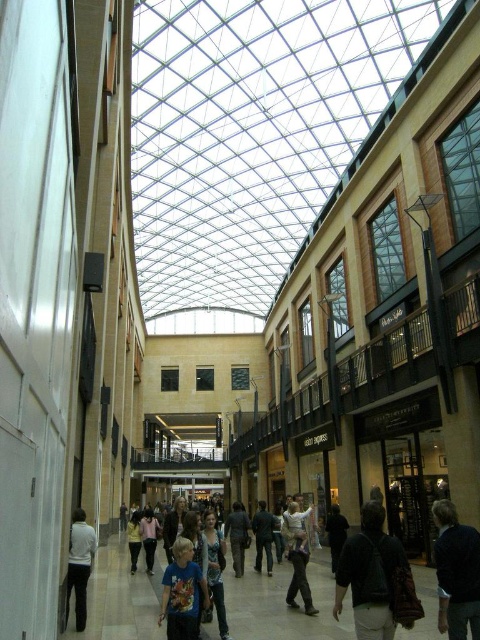
Question: Among these points, which one is nearest to the camera?

Choices:
 (A) (182, 628)
 (B) (435, 540)
 (C) (264, 522)
 (D) (73, 536)

Answer: (A)

Question: Among these objects, which one is farthest from the camera?

Choices:
 (A) dark blue jacket at center
 (B) dark blue jeans at center

Answer: (B)

Question: Is dark gray backpack at lower right below dark blue jeans at center?

Choices:
 (A) no
 (B) yes

Answer: (A)

Question: Is dark gray backpack at lower right closer to the viewer compared to dark blue jeans at center?

Choices:
 (A) yes
 (B) no

Answer: (A)

Question: Is dark gray backpack at lower right bigger than dark blue jacket at center?

Choices:
 (A) no
 (B) yes

Answer: (A)

Question: Which object appears closest to the camera in this image?

Choices:
 (A) blue t-shirt at center
 (B) white matte pants at lower left
 (C) dark blue jeans at center
 (D) dark gray backpack at lower right

Answer: (D)